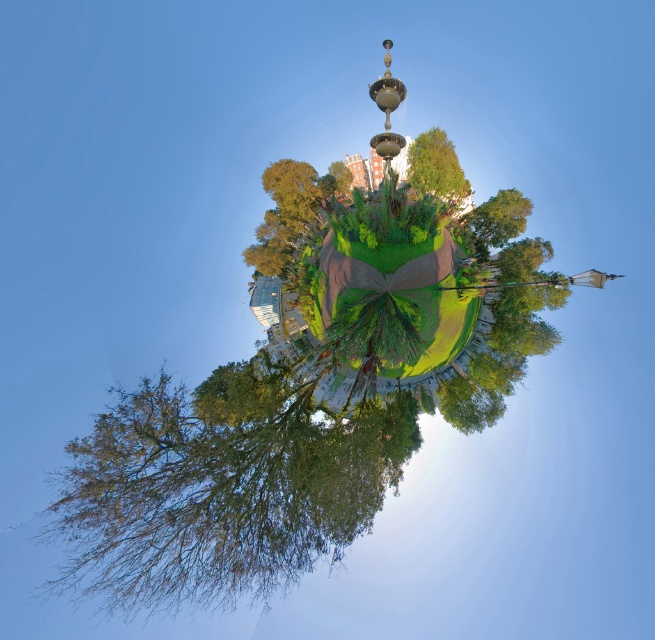
You are a photographer planning to capture a wide shot of the green leafy tree at lower left and the green leafy tree at center. Considering their sizes, which tree should you focus on to ensure it fits entirely within your camera frame?

The green leafy tree at lower left might be wider than the green leafy tree at center, so focusing on the green leafy tree at center would be safer to ensure it fits entirely within the camera frame.

You are standing at the center of the spherical panorama of the urban park. You notice two points marked in the image. The first point is at coordinates point (83, 461) and the second is at point (447, 177). If you want to reach the point that is closer to you, which coordinates should you head towards?

You should head towards point (83, 461) because it is closer to the viewer than point (447, 177).

You are standing in the center of the spherical panorama of the urban park. You notice two points marked in the image. The first point is at coordinates point (253, 250) and the second at point (390, 147). Which of these two points is nearer to your current position?

Point (253, 250) is closer to the viewer than point (390, 147), so the first point is nearer to your current position.